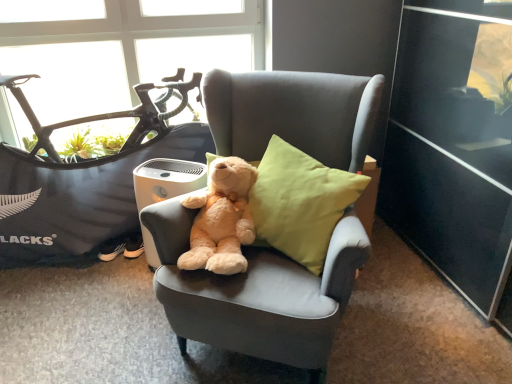
Question: Which is correct: linen-like green pillow at center, placed as the 2th pillow when sorted from right to left, is inside transparent glass window at upper left, or outside of it?

Choices:
 (A) outside
 (B) inside

Answer: (A)

Question: Based on their positions, is linen-like green pillow at center, which is counted as the 1th pillow, starting from the left, located to the left or right of transparent glass window at upper left?

Choices:
 (A) right
 (B) left

Answer: (A)

Question: Which is nearer to the soft gray fabric chair at center?

Choices:
 (A) light brown plush teddy bear at center
 (B) linen-like green pillow at center, placed as the 2th pillow when sorted from right to left
 (C) transparent glass window at upper left
 (D) linen cushion at center, acting as the 1th pillow starting from the right
 (E) black matte mountain bike at left

Answer: (D)

Question: Which is nearer to the transparent glass window at upper left?

Choices:
 (A) linen cushion at center, the second pillow positioned from the left
 (B) linen-like green pillow at center, which is counted as the 1th pillow, starting from the left
 (C) black matte mountain bike at left
 (D) light brown plush teddy bear at center
 (E) soft gray fabric chair at center

Answer: (C)